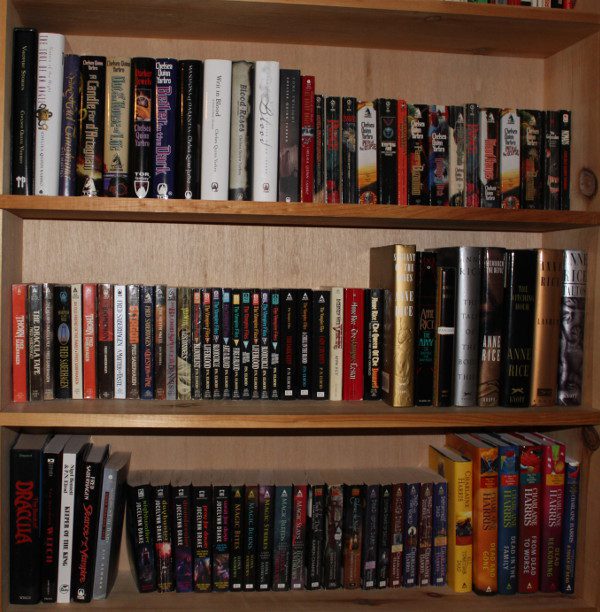
Find the location of a particular element. Image resolution: width=600 pixels, height=612 pixels. shelf is located at coordinates (415, 600), (389, 424), (408, 207), (498, 32).